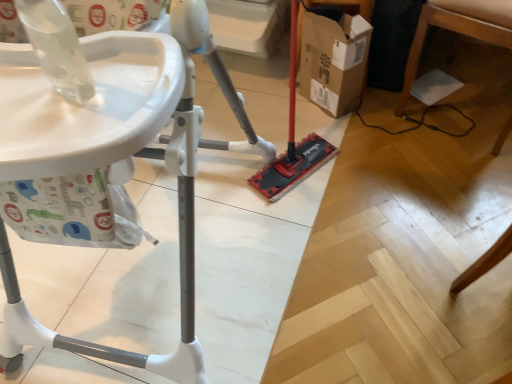
This screenshot has height=384, width=512. Identify the location of free region under wooden table leg at lower right, the 1th furniture positioned from the right (from a real-world perspective). (457, 97).